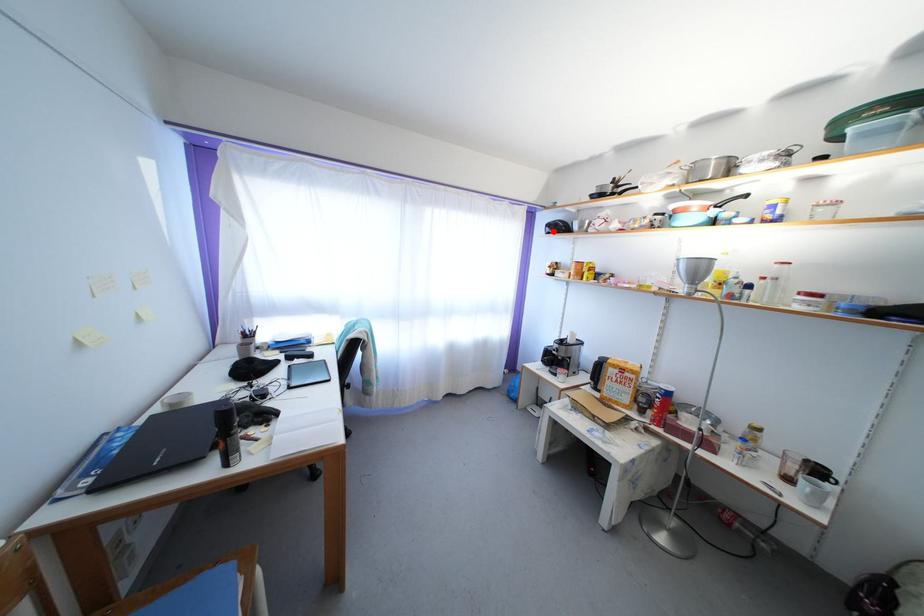
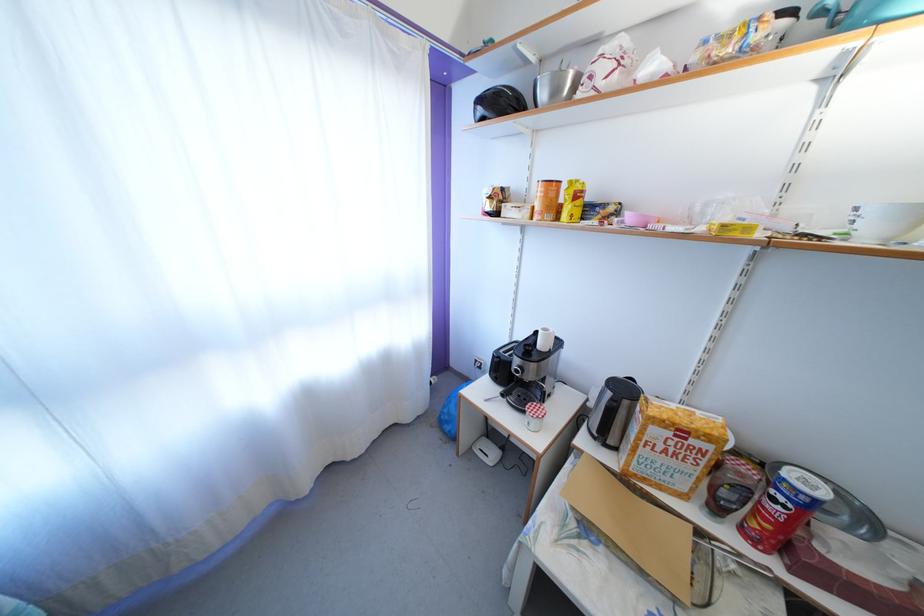
Where in the second image is the point corresponding to the highlighted location from the first image?

(484, 107)